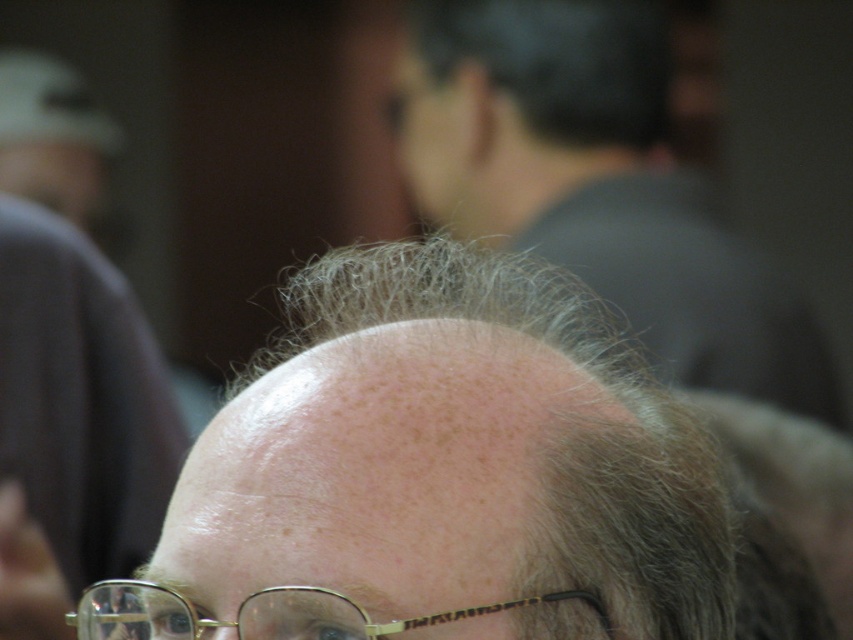
You are taking a photo of a person and notice two points on their face. One is at position point (727, 324) and the other at point (102, 360). Which point is closer to the camera?

Point (727, 324) is further to the camera than point (102, 360), so the point closer to the camera is point (102, 360).

You are a photographer standing in front of the smooth skin head at center. You want to take a close up photo of the person. What is the minimum distance you should maintain to ensure the camera can focus properly?

The smooth skin head at center and viewer are 6.13 feet apart from each other. To ensure proper focus, the photographer should maintain a distance of at least 6.13 feet from the smooth skin head at center.

You are a dermatologist examining a patient. The patient has a receding hairline and wants to know if their gray hair is in the center of their scalp. Based on the image, is the slightly gray hair at center positioned at the center of the scalp?

The slightly gray hair at center is located at point (80, 397), which is not exactly at the center coordinates of the scalp. Therefore, the gray hair is not precisely at the center of the scalp.